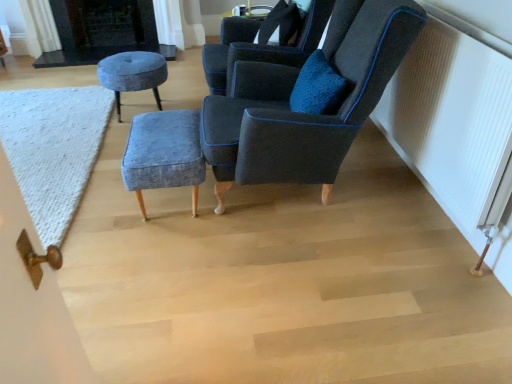
Image resolution: width=512 pixels, height=384 pixels. Identify the location of vacant region to the left of white textured radiator at right. (323, 218).